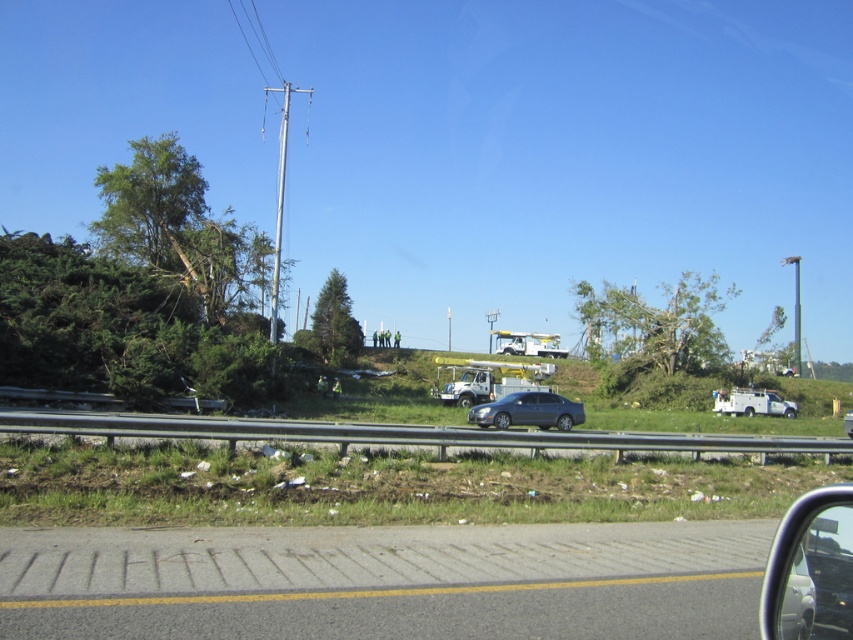
Question: Which point appears closest to the camera in this image?

Choices:
 (A) (645, 440)
 (B) (334, 301)

Answer: (A)

Question: Is green matte tree at center further to the viewer compared to white matte utility truck at right?

Choices:
 (A) yes
 (B) no

Answer: (A)

Question: Which of the following is the closest to the observer?

Choices:
 (A) green leafy tree at center
 (B) green matte tree at center

Answer: (A)

Question: Does green leafy tree at center come in front of white matte utility truck at right?

Choices:
 (A) yes
 (B) no

Answer: (B)

Question: Which of the following is the farthest from the observer?

Choices:
 (A) metallic gray guardrail at center
 (B) green leafy tree at center

Answer: (B)

Question: Where is clear glass car window at lower right located in relation to satin gray sedan at center in the image?

Choices:
 (A) left
 (B) right

Answer: (B)